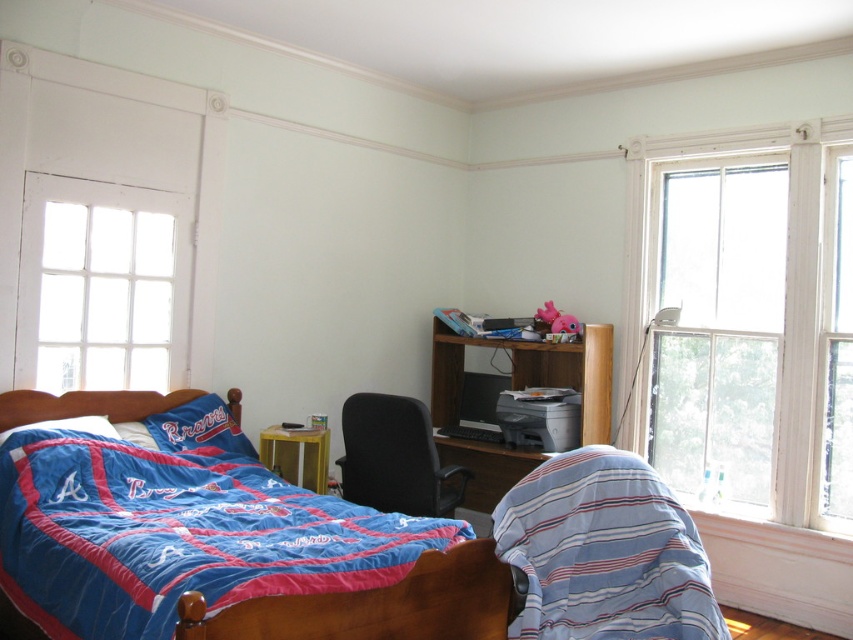
Does wooden desk at center appear over black fabric chair at center?

Yes, wooden desk at center is above black fabric chair at center.

Which is in front, point (463, 458) or point (427, 512)?

Point (427, 512) is more forward.

This screenshot has height=640, width=853. Describe the element at coordinates (529, 374) in the screenshot. I see `wooden desk at center` at that location.

You are a GUI agent. You are given a task and a screenshot of the screen. Output one action in this format:
    pyautogui.click(x=<x>, y=<y>)
    Task: Click on the wooden desk at center
    This screenshot has width=853, height=640.
    Given the screenshot: What is the action you would take?
    pyautogui.click(x=529, y=374)

Find the location of a particular element. This screenshot has width=853, height=640. clear glass window at upper left is located at coordinates coord(102,285).

Who is more distant from viewer, (x=111, y=320) or (x=589, y=396)?

The point (x=589, y=396) is more distant.

Does point (165, 280) come farther from viewer compared to point (608, 388)?

That is False.

Find the location of `clear glass window at upper left`. clear glass window at upper left is located at coordinates (102, 285).

Who is lower down, clear glass window at upper left or black fabric chair at center?

black fabric chair at center

Which of these two, clear glass window at upper left or black fabric chair at center, stands taller?

clear glass window at upper left is taller.

Is point (59, 326) less distant than point (381, 506)?

That is True.

You are a GUI agent. You are given a task and a screenshot of the screen. Output one action in this format:
    pyautogui.click(x=<x>, y=<y>)
    Task: Click on the clear glass window at upper left
    The width and height of the screenshot is (853, 640).
    Given the screenshot: What is the action you would take?
    pyautogui.click(x=102, y=285)